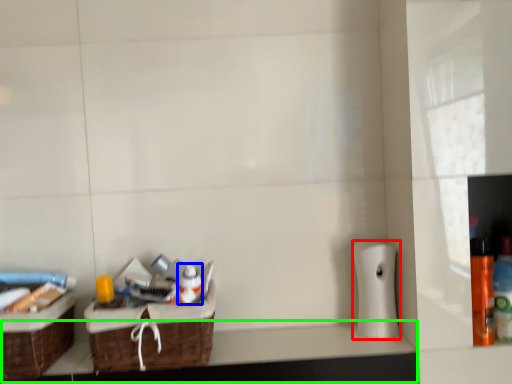
Question: Based on their relative distances, which object is farther from toilet paper (highlighted by a red box)? Choose from mouthwash (highlighted by a blue box) and counter top (highlighted by a green box).

Choices:
 (A) mouthwash
 (B) counter top

Answer: (A)